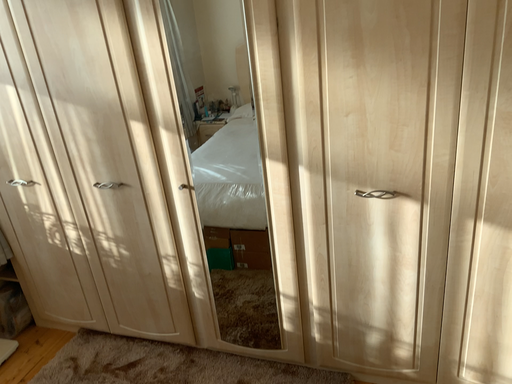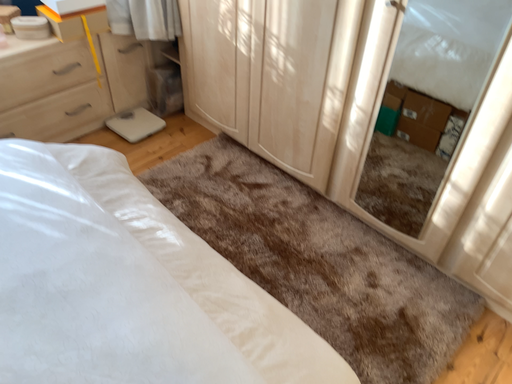
Question: How did the camera likely rotate when shooting the video?

Choices:
 (A) rotated right
 (B) rotated left

Answer: (B)